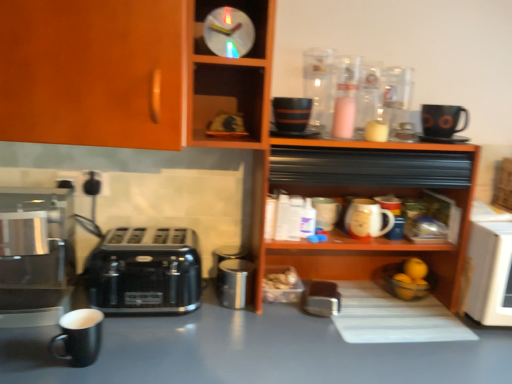
You are a GUI agent. You are given a task and a screenshot of the screen. Output one action in this format:
    pyautogui.click(x=<x>, y=<y>)
    Task: Click on the free spot in front of wooden shelf at upper center
    Image resolution: width=512 pixels, height=384 pixels.
    Given the screenshot: What is the action you would take?
    pyautogui.click(x=346, y=362)